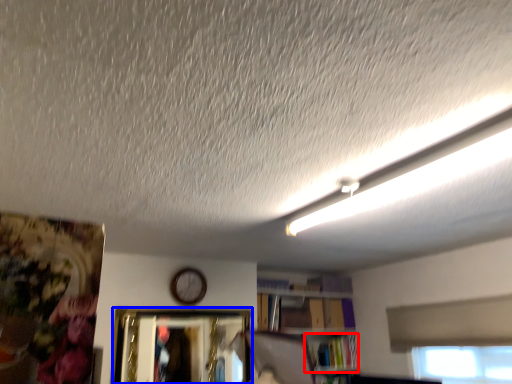
Question: Which of the following is the closest to the observer, book (highlighted by a red box) or picture frame (highlighted by a blue box)?

Choices:
 (A) book
 (B) picture frame

Answer: (B)